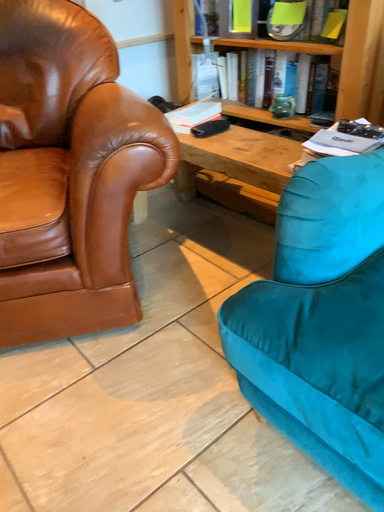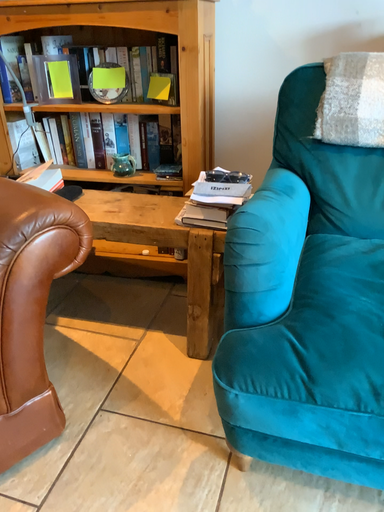
Question: Which way did the camera rotate in the video?

Choices:
 (A) rotated downward
 (B) rotated upward

Answer: (B)